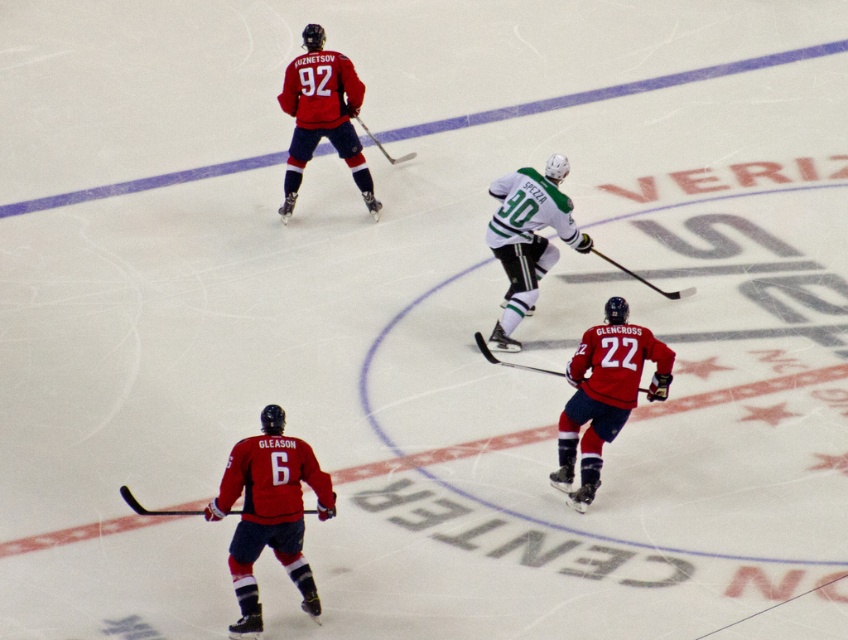
Question: Which point is farther to the camera?

Choices:
 (A) matte black hockey stick at upper center
 (B) red jersey at center
 (C) white matte jersey at center

Answer: (A)

Question: Which object is the closest to the matte black hockey stick at lower center?

Choices:
 (A) matte black hockey stick at center
 (B) matte red jersey at upper left
 (C) matte red jersey at lower left

Answer: (C)

Question: Does matte red jersey at upper left appear on the right side of matte black hockey stick at lower center?

Choices:
 (A) yes
 (B) no

Answer: (A)

Question: Does black glossy hockey stick at center appear on the right side of matte black hockey stick at center?

Choices:
 (A) yes
 (B) no

Answer: (A)

Question: Which object appears farthest from the camera in this image?

Choices:
 (A) matte black hockey stick at upper center
 (B) matte red jersey at lower left

Answer: (A)

Question: Can you confirm if white matte jersey at center is thinner than black glossy hockey stick at center?

Choices:
 (A) yes
 (B) no

Answer: (A)